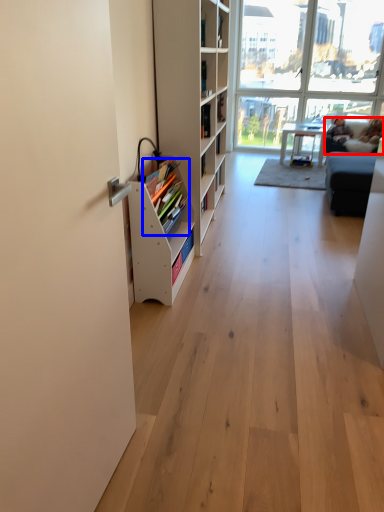
Question: Which object appears farthest to the camera in this image, couch (highlighted by a red box) or book (highlighted by a blue box)?

Choices:
 (A) couch
 (B) book

Answer: (A)